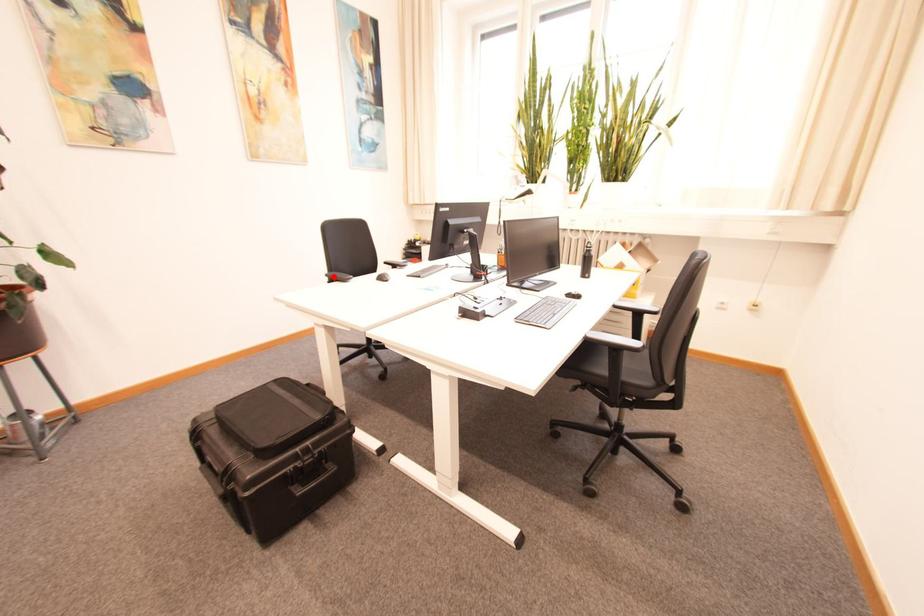
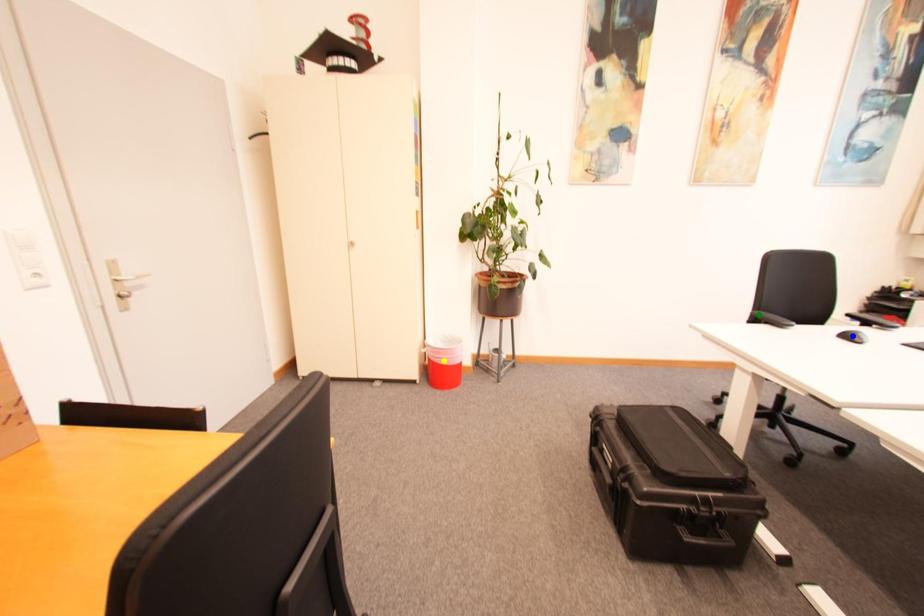
Question: I am providing you with two images of the same scene from different viewpoints. A red point is marked on the first image. You are given multiple points on the second image. Which point in image 2 represents the same 3d spot as the red point in image 1?

Choices:
 (A) blue point
 (B) yellow point
 (C) green point

Answer: (C)